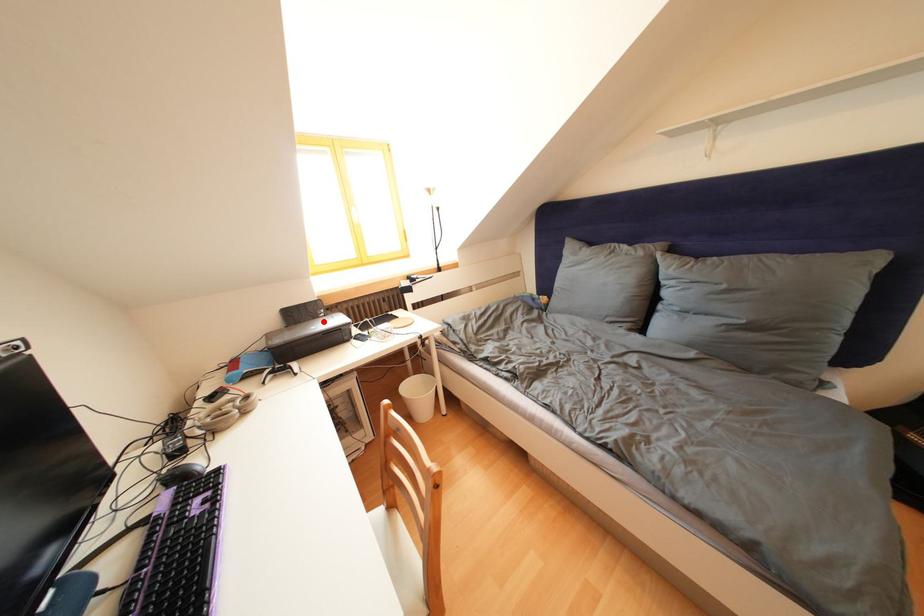
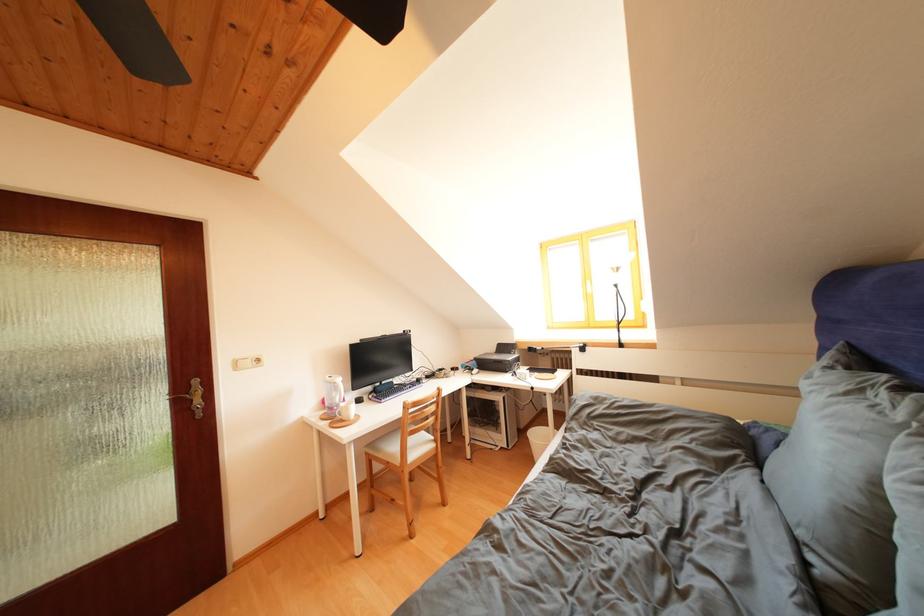
Question: I am providing you with two images of the same scene from different viewpoints. A red point is marked on the first image. Is the red point's position out of view in image 2?

Choices:
 (A) Yes
 (B) No

Answer: (B)